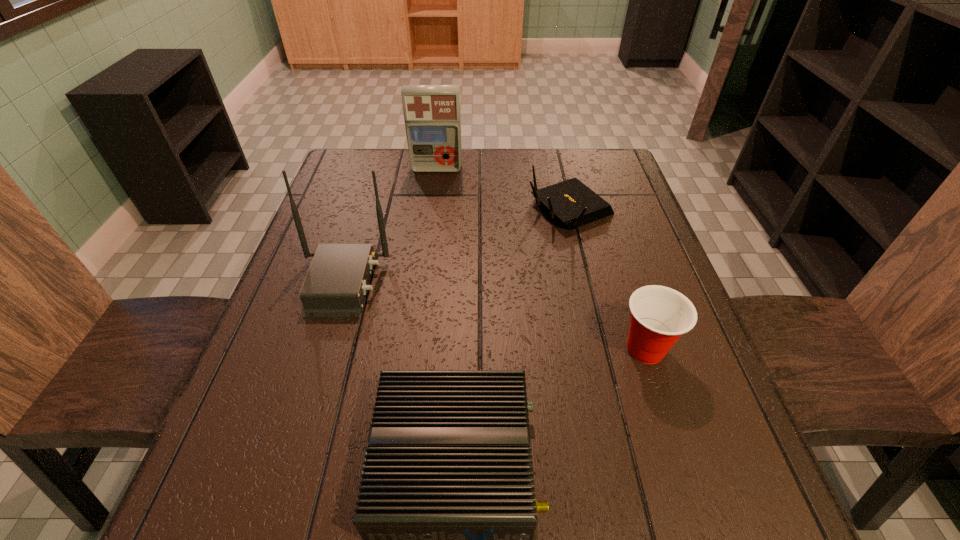
Identify which router is the nearest to the cup. Please provide its 2D coordinates. Your answer should be formatted as a tuple, i.e. [(x, y)], where the tuple contains the x and y coordinates of a point satisfying the conditions above.

[(447, 512)]

Identify the location of vacant region that satisfies the following two spatial constraints: 1. on the front-facing side of the farthest router; 2. on the left side of the first-aid kit. (431, 210).

This screenshot has height=540, width=960. I want to click on vacant area in the image that satisfies the following two spatial constraints: 1. on the front-facing side of the first-aid kit; 2. on the back of the leftmost object to connect cables, so click(421, 283).

The image size is (960, 540). I want to click on vacant space that satisfies the following two spatial constraints: 1. on the front-facing side of the farthest object; 2. on the left side of the rightmost router, so click(431, 210).